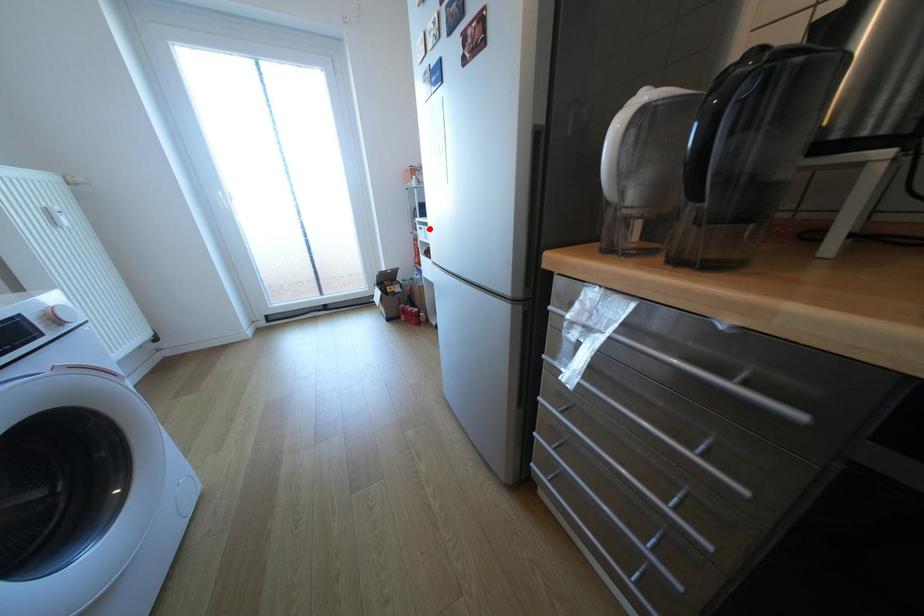
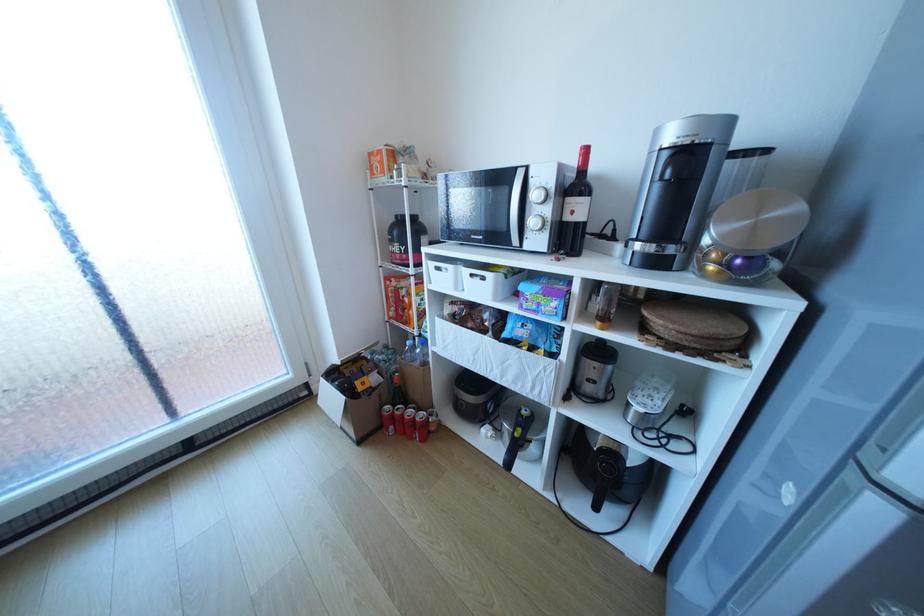
The point at the highlighted location is marked in the first image. Where is the corresponding point in the second image?

(446, 268)